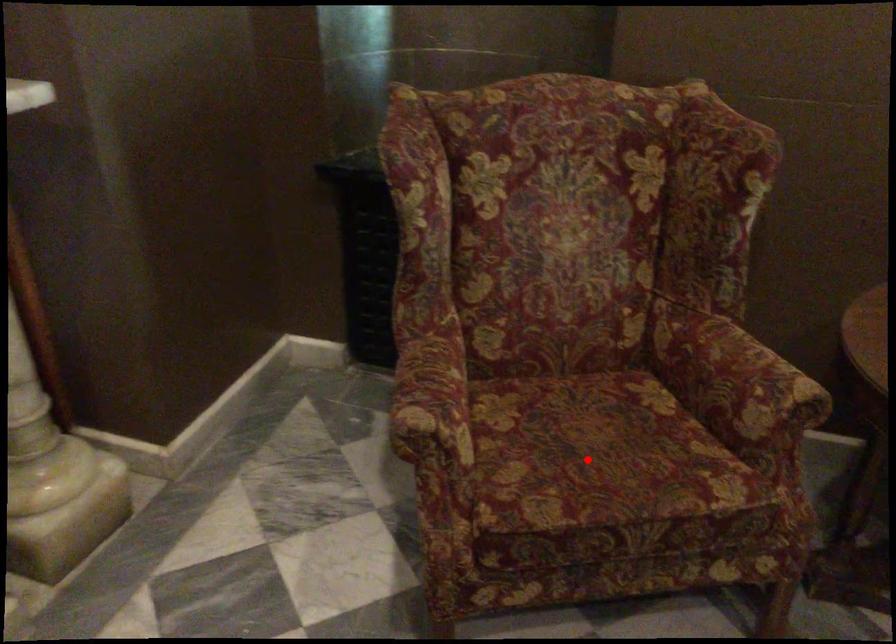
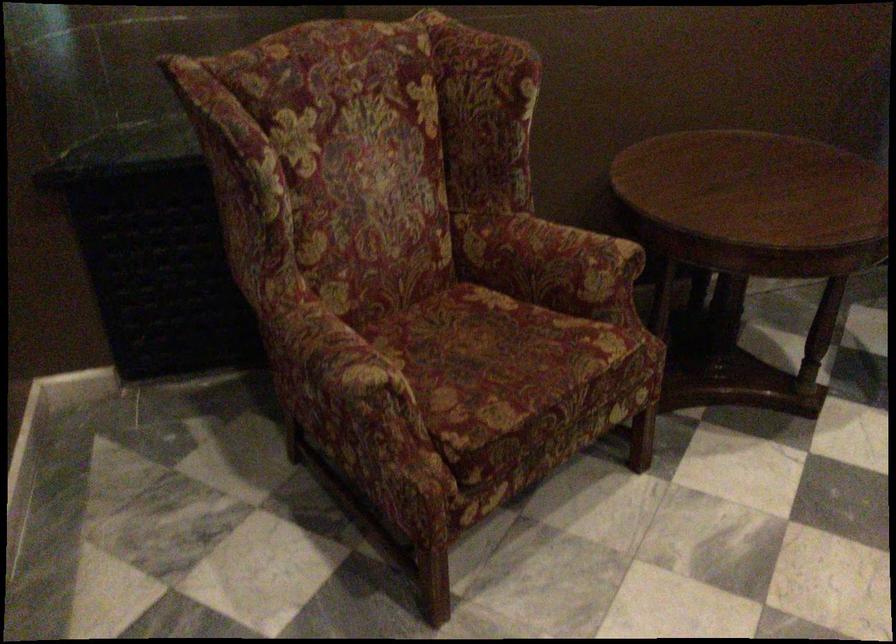
Question: I am providing you with two images of the same scene from different viewpoints. A red point is marked on the first image. At the location where the point appears in image 1, is it still visible in image 2?

Choices:
 (A) Yes
 (B) No

Answer: (A)